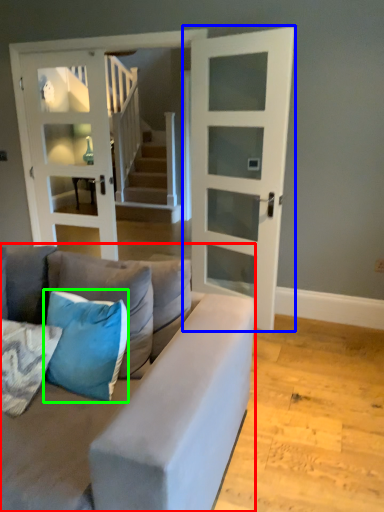
Question: Which is nearer to the studio couch (highlighted by a red box)? door (highlighted by a blue box) or pillow (highlighted by a green box).

Choices:
 (A) door
 (B) pillow

Answer: (B)